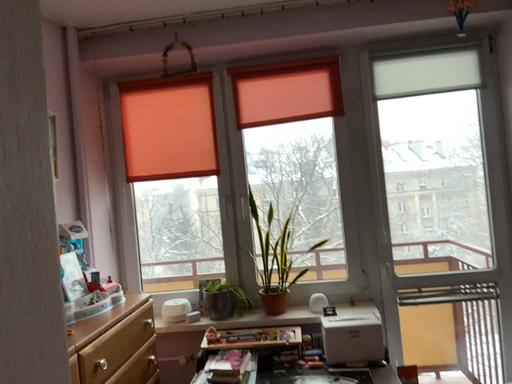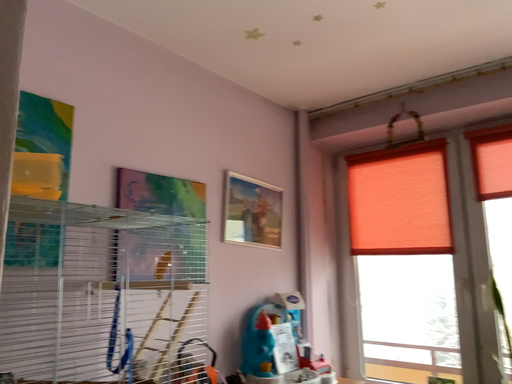
Question: How did the camera likely rotate when shooting the video?

Choices:
 (A) rotated left
 (B) rotated right

Answer: (A)